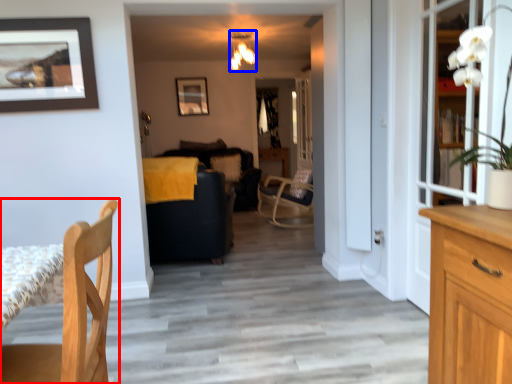
Question: Among these objects, which one is nearest to the camera, chair (highlighted by a red box) or lamp (highlighted by a blue box)?

Choices:
 (A) chair
 (B) lamp

Answer: (A)